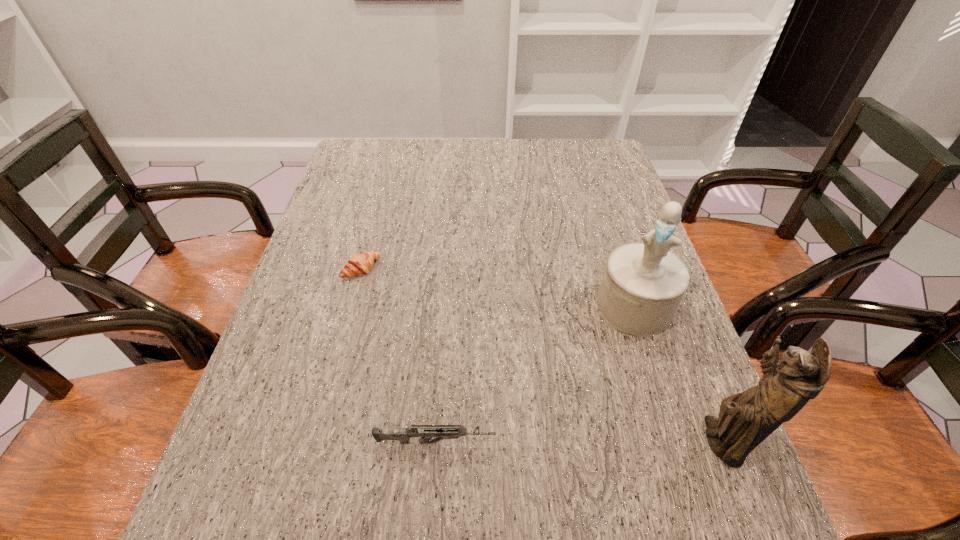
This screenshot has height=540, width=960. In the image, there is a desktop. Find the location of `vacant space at the far edge`. vacant space at the far edge is located at coordinates (525, 145).

Locate an element on the screen. vacant space at the left edge of the desktop is located at coordinates (302, 296).

Where is `vacant space at the right edge`? vacant space at the right edge is located at coordinates (650, 348).

Identify the location of vacant space at the far left corner of the desktop. This screenshot has height=540, width=960. (351, 145).

The image size is (960, 540). In order to click on free space at the near left corner of the desktop in this screenshot , I will do `click(270, 451)`.

The image size is (960, 540). What are the coordinates of `free space at the far right corner of the desktop` in the screenshot? It's located at (581, 157).

The width and height of the screenshot is (960, 540). I want to click on blank space at the near right corner, so click(655, 472).

Where is `unoccupied area between the second shortest object and the farther figurine`? The image size is (960, 540). unoccupied area between the second shortest object and the farther figurine is located at coordinates (535, 375).

At what (x,y) coordinates should I click in order to perform the action: click on free area in between the nearer figurine and the shortest object. Please return your answer as a coordinate pair (x, y). Looking at the image, I should click on (540, 355).

The height and width of the screenshot is (540, 960). What are the coordinates of `unoccupied position between the shortest object and the third object from right to left` in the screenshot? It's located at (398, 356).